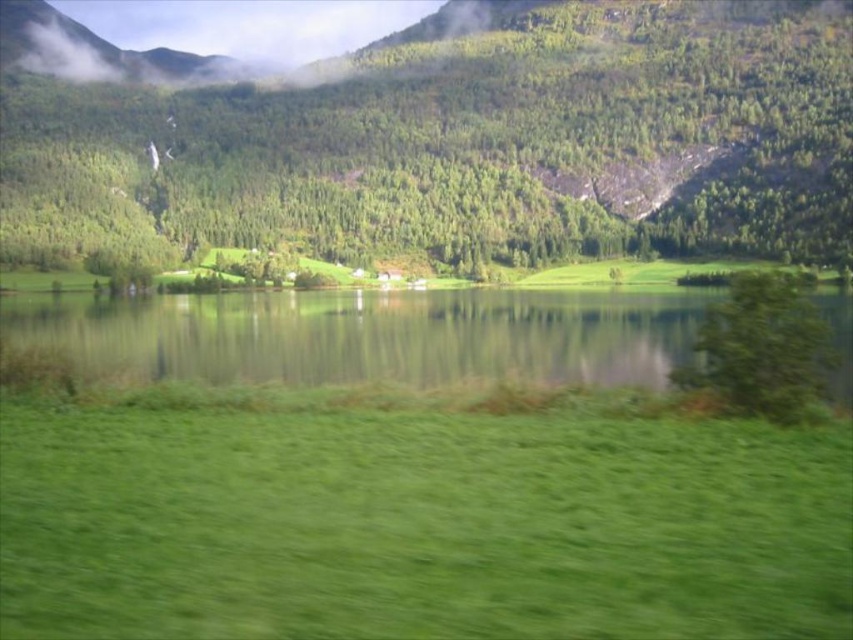
Question: Can you confirm if green grass at lower center is positioned to the left of green leafy tree at center?

Choices:
 (A) yes
 (B) no

Answer: (B)

Question: Can you confirm if green grass at lower center is thinner than green leafy tree at right?

Choices:
 (A) no
 (B) yes

Answer: (A)

Question: Can you confirm if green grass at lower center is positioned above green leafy tree at center?

Choices:
 (A) yes
 (B) no

Answer: (B)

Question: Considering the real-world distances, which object is closest to the green grassy field at lower center?

Choices:
 (A) green grass at lower center
 (B) green leafy tree at right

Answer: (A)

Question: Among these objects, which one is nearest to the camera?

Choices:
 (A) green leafy tree at center
 (B) green grass at lower center
 (C) green leafy tree at right

Answer: (B)

Question: Which point appears farthest from the camera in this image?

Choices:
 (A) 799,417
 (B) 91,515

Answer: (A)